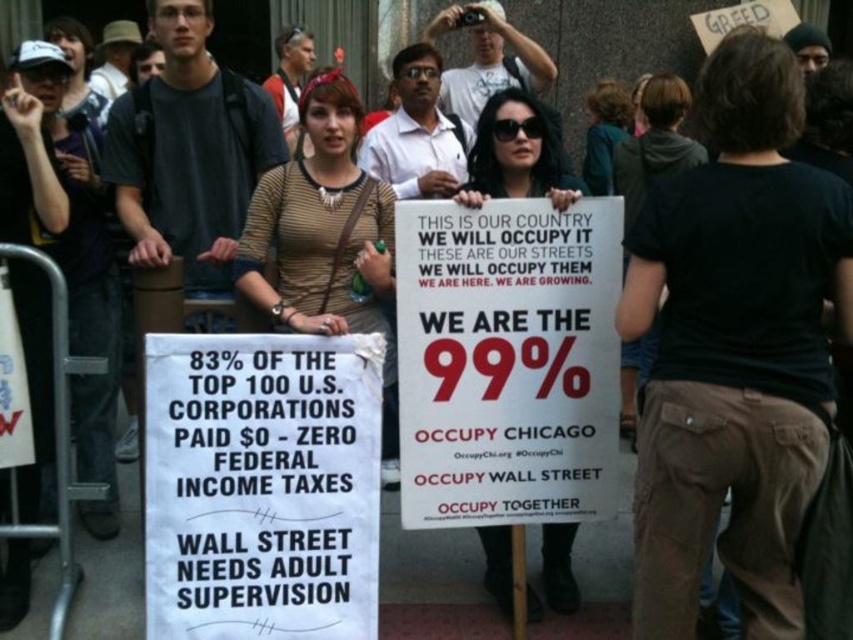
In the protest scene described, you notice two items in the foreground. The first is a matte white sign at center, and the second is a black cotton shirt at upper right. Based on their sizes, which item would appear closer to the observer?

The matte white sign at center has a smaller size compared to the black cotton shirt at upper right. Since objects closer to the observer appear larger, the black cotton shirt at upper right is likely closer to the observer.

You are a journalist trying to capture the protest scene. You notice two signs at the center of the image. Which sign is closer to the camera, the white paper sign at center or the matte white sign at center?

The white paper sign at center is positioned under the matte white sign at center, so the matte white sign at center is closer to the camera.